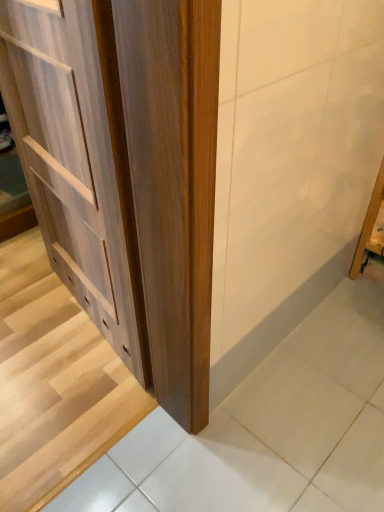
Where is `free space to the left of light wood cabinet at left`? This screenshot has height=512, width=384. free space to the left of light wood cabinet at left is located at coordinates (33, 315).